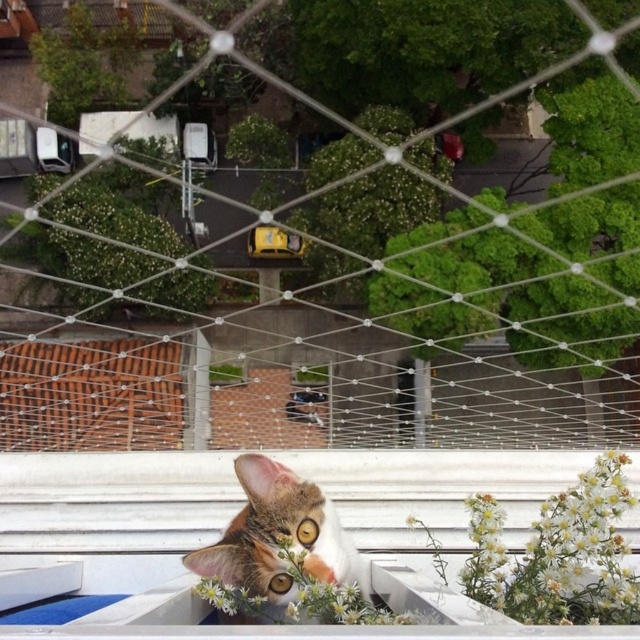
Question: Does white mesh netting at center have a larger size compared to tabby fur cat at center?

Choices:
 (A) no
 (B) yes

Answer: (B)

Question: Which point appears closest to the camera in this image?

Choices:
 (A) (314, 497)
 (B) (481, 102)

Answer: (A)

Question: Which point is closer to the camera taking this photo?

Choices:
 (A) (76, 225)
 (B) (273, 550)

Answer: (B)

Question: Does white mesh netting at center have a smaller size compared to tabby fur cat at center?

Choices:
 (A) yes
 (B) no

Answer: (B)

Question: Does white mesh netting at center appear under tabby fur cat at center?

Choices:
 (A) no
 (B) yes

Answer: (A)